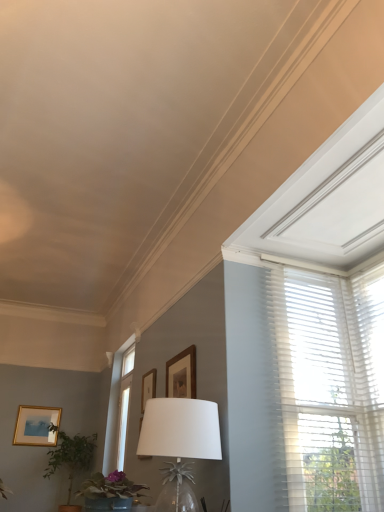
Question: From the image's perspective, is white glass table lamp at center above or below wooden picture frame at upper center, arranged as the second picture frame when viewed from the top?

Choices:
 (A) above
 (B) below

Answer: (A)

Question: Based on their positions, is white glass table lamp at center located to the left or right of wooden picture frame at upper center, arranged as the second picture frame when viewed from the top?

Choices:
 (A) right
 (B) left

Answer: (A)

Question: Which object is positioned farthest from the matte gold picture frame at lower left, the 3th picture frame when ordered from right to left?

Choices:
 (A) green matte plant at lower left, the 2th houseplant when ordered from left to right
 (B) white sheer blinds at upper right
 (C) green leafy plant at lower left, marked as the second houseplant in a top-to-bottom arrangement
 (D) wooden picture frame at upper center, marked as the second picture frame in a bottom-to-top arrangement
 (E) white glass table lamp at center

Answer: (B)

Question: Which object is positioned closest to the white glass table lamp at center?

Choices:
 (A) green leafy plant at lower left, acting as the 2th houseplant starting from the front
 (B) white sheer blinds at upper right
 (C) wooden picture frame at upper center, which appears as the 2th picture frame when viewed from the back
 (D) green matte plant at lower left, placed as the 1th houseplant when sorted from right to left
 (E) matte gold picture frame at lower left, which ranks as the 3th picture frame in front-to-back order

Answer: (D)